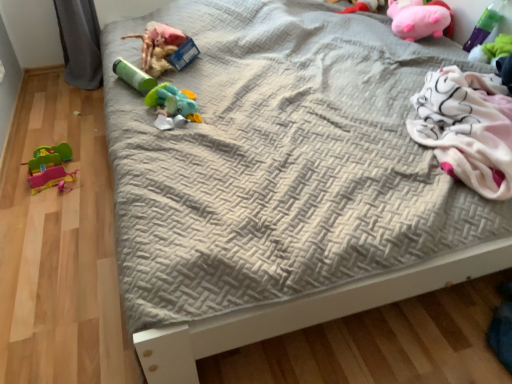
Locate an element on the screen. The height and width of the screenshot is (384, 512). free space in front of rubber duck at left, acting as the first toy starting from the left is located at coordinates (41, 212).